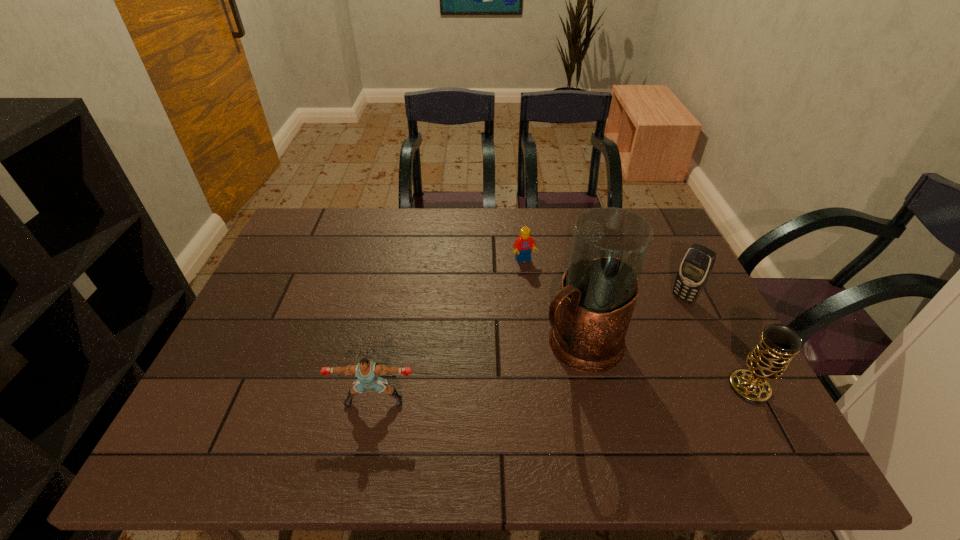
Find the location of a particular element. free spot on the desktop that is between the puncher and the chalice and is positioned on the face of the Lego is located at coordinates (587, 393).

Find the location of a particular element. This screenshot has height=540, width=960. vacant space on the desktop that is between the fourth tallest object and the chalice and is positioned on the front face of the cellular telephone is located at coordinates (585, 393).

The image size is (960, 540). What are the coordinates of `free space on the desktop that is between the leftmost object and the chalice and is positioned with the handle on the side of the pitcher` in the screenshot? It's located at (513, 396).